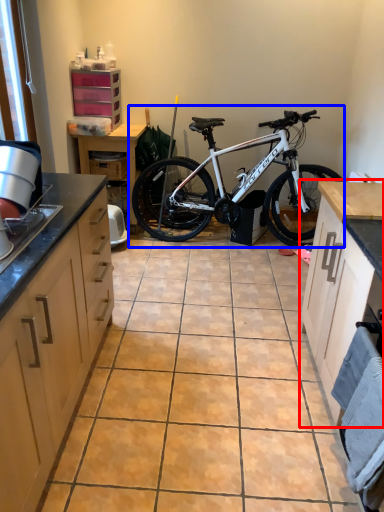
Question: Which of the following is the farthest to the observer, cabinetry (highlighted by a red box) or bicycle (highlighted by a blue box)?

Choices:
 (A) cabinetry
 (B) bicycle

Answer: (B)